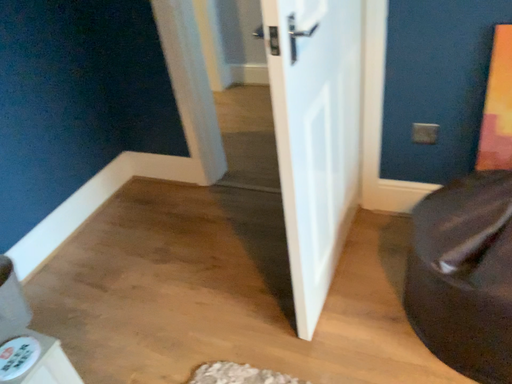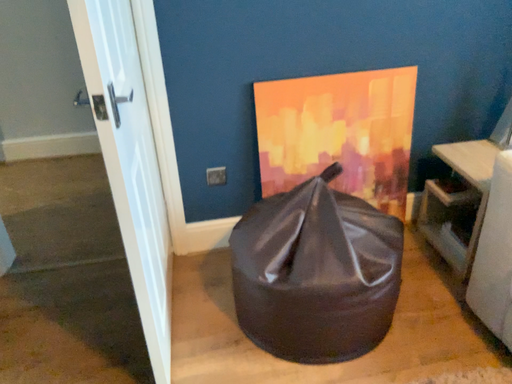
Question: Which way did the camera rotate in the video?

Choices:
 (A) rotated upward
 (B) rotated downward

Answer: (A)